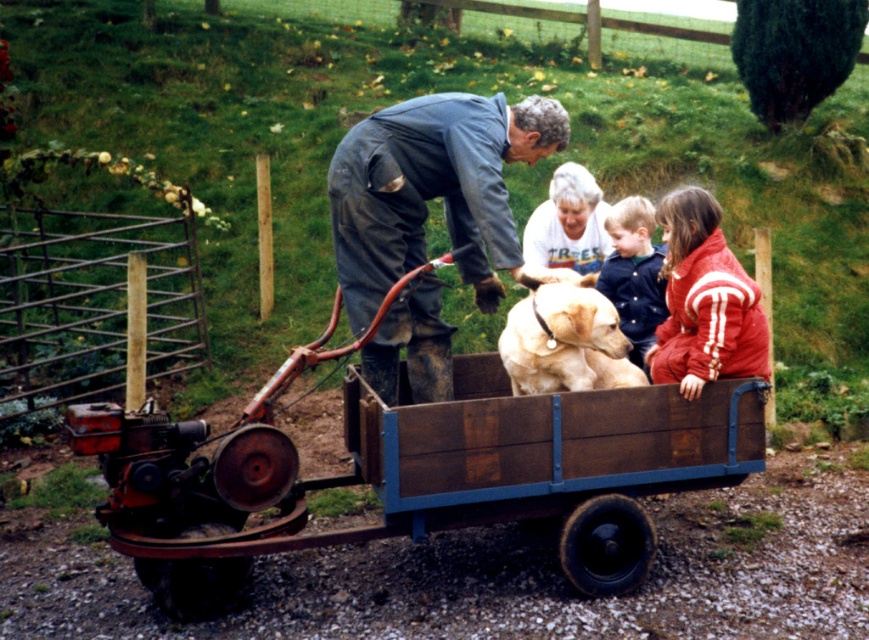
In the scene shown: You are standing in the garden and want to take a photo of both the golden fur dog at center and the blue denim jacket at center without any obstructions. Based on their positions, which one should you focus on first to ensure both are in frame?

The golden fur dog at center is in front of the blue denim jacket at center. To ensure both are in frame without obstructions, focus on the blue denim jacket at center first, then adjust the camera to include the golden fur dog at center in front of it.

From the picture: You are a photographer trying to capture a photo of the golden fur dog at center and the blue denim jacket at center. Based on their positions, which object is located to the left?

The golden fur dog at center is positioned on the left side of the blue denim jacket at center, so the golden fur dog at center is to the left.

You are a delivery robot with a package that needs to be placed between the rusty wood wagon at center and the dark blue coveralls at center. The package is 32 inches long. Can you fit the package between them without it overlapping either object?

The distance between the rusty wood wagon at center and the dark blue coveralls at center is 31.97 inches. Since the package is 32 inches long, it would be slightly too long to fit between them without overlapping either object.